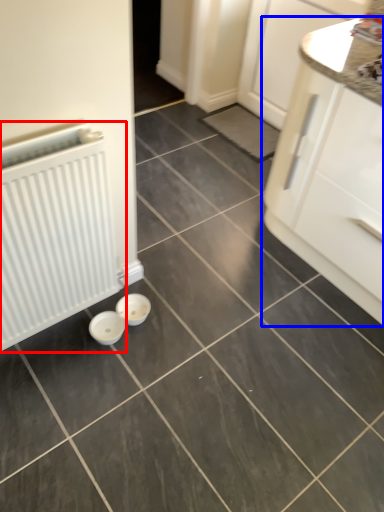
Question: Among these objects, which one is farthest to the camera, radiator (highlighted by a red box) or cabinetry (highlighted by a blue box)?

Choices:
 (A) radiator
 (B) cabinetry

Answer: (B)